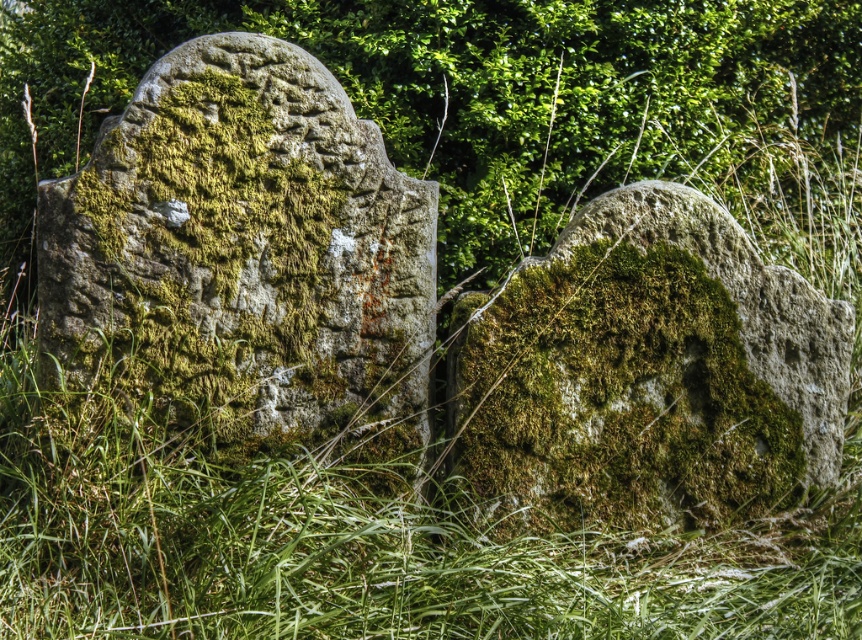
You are standing in a neglected cemetery and see the point marked at coordinates (507, 106). What object is located at that point?

The point at coordinates (507, 106) indicates the green mossy stone at upper center.

You are a groundskeeper tasked with clearing the area around both green mossy stone at upper center and green mossy stone at left. Given that the larger stone requires more effort to clear, which stone should you prioritize based on their sizes?

The green mossy stone at upper center is larger than the green mossy stone at left, so you should prioritize clearing around the green mossy stone at upper center first since it requires more effort.

You are standing at the center of the cemetery. You need to locate the green mossy stone at left. Based on its coordinates, in which direction should you move to find it?

The green mossy stone at left is located at coordinates point (245, 257). Since you are at the center, moving towards the left direction would lead you to it.